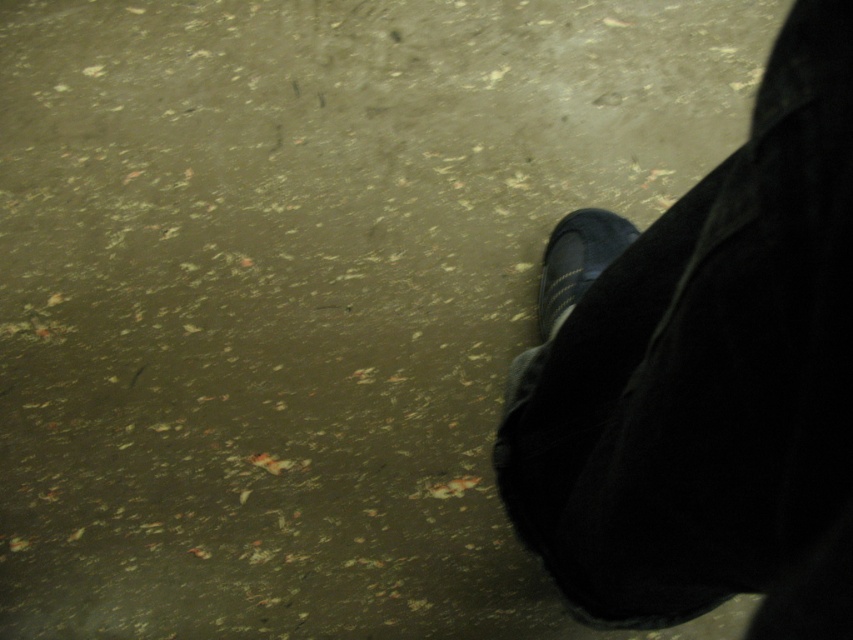
Can you confirm if black fabric shoe at lower right is smaller than matte black shoe at lower right?

Incorrect, black fabric shoe at lower right is not smaller in size than matte black shoe at lower right.

Between point (828, 628) and point (563, 305), which one is positioned behind?

The point (563, 305) is behind.

Between point (821, 259) and point (581, 252), which one is positioned in front?

Point (821, 259) is in front.

The width and height of the screenshot is (853, 640). In order to click on black fabric shoe at lower right in this screenshot , I will do `click(704, 376)`.